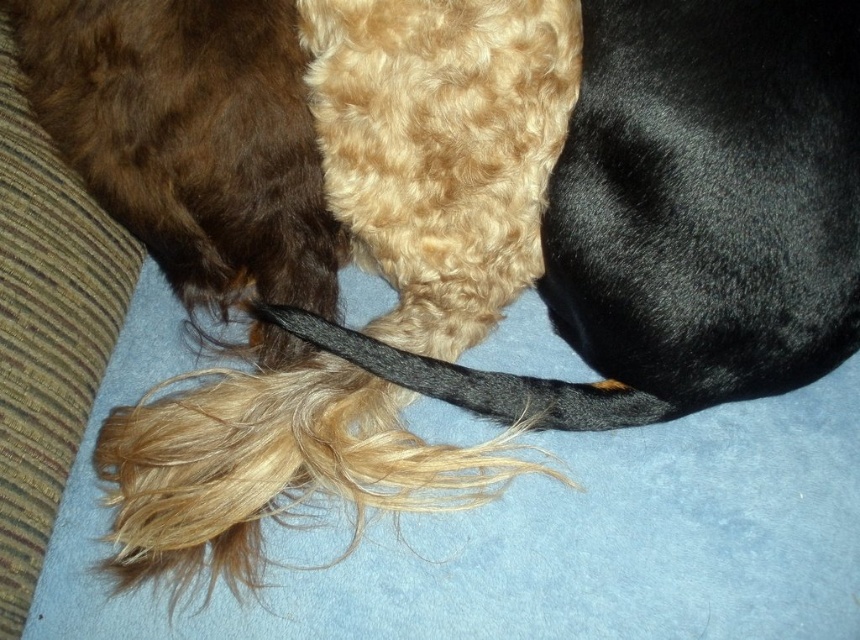
You are a dog groomer observing the three dogs lying on the light blue surface. You need to determine which area requires more shampoo based on their fur size. Which of the following has a larger size and thus needs more shampoo? The brown fuzzy fur at upper left or the black silky tail at center?

The brown fuzzy fur at upper left has a larger size compared to the black silky tail at center, so it requires more shampoo.

You are a photographer trying to capture a close shot of the brown fuzzy fur at upper left and the black silky tail at center. Which of the two has a smaller width?

The brown fuzzy fur at upper left has a lesser width compared to the black silky tail at center.

You are a photographer taking a close up shot of three dogs lying on a light blue surface. You need to focus on the brown fuzzy fur at upper left. Where exactly should you aim your camera to capture it?

The brown fuzzy fur at upper left is located at point (191, 138), so aim your camera at those coordinates to capture it accurately.